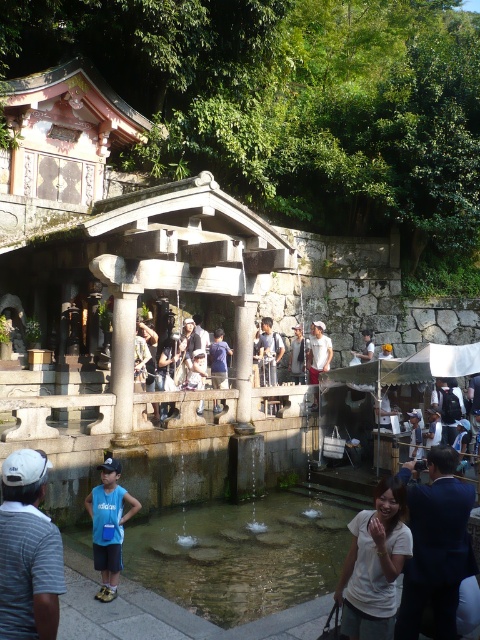
You are standing at the point labeled as point (189, 524) in the image of a traditional Japanese shrine. A visitor asks you how far they need to walk from their current position to reach the purification fountain located at the center of the scene. Based on the image details, what is the approximate distance they should expect?

The point labeled (189, 524) is 22.30 meters away from the viewer. Since the purification fountain is at the center, the distance from the viewer to the fountain would depend on their exact positions, but the given point is 22.30 meters away from the viewer.

You are a photographer standing at the edge of the shrine area and want to capture a photo of the clear water at fountain center and the white cotton shirt at lower right. Based on their positions, which object is more likely to be in the foreground of the photo?

The white cotton shirt at lower right is more likely to be in the foreground because it is positioned closer to the photographer than the clear water at fountain center.

You are a visitor at the shrine and want to know if you can see the clear water at fountain center from where the white striped shirt at lower left is located. Can you see it?

The clear water at fountain center is not as tall as the white striped shirt at lower left, so yes, the visitor can see the clear water at fountain center from the position of the white striped shirt at lower left because the water is lower in height compared to the shirt.